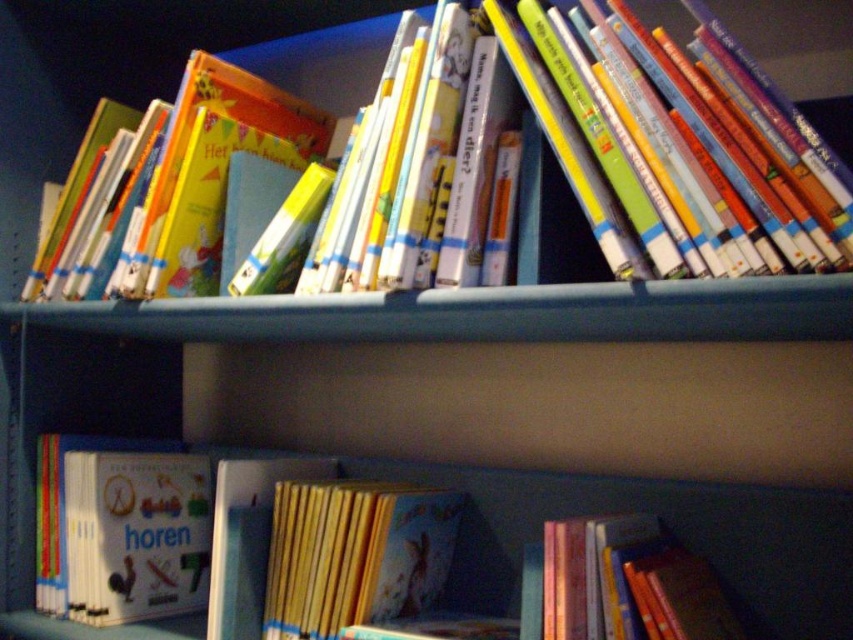
Is hardcover books at upper center closer to the viewer compared to shiny pink book at lower right?

That is True.

Where is `hardcover books at upper center`? This screenshot has height=640, width=853. hardcover books at upper center is located at coordinates (675, 145).

At what (x,y) coordinates should I click in order to perform the action: click on hardcover books at upper center. Please return your answer as a coordinate pair (x, y). Looking at the image, I should click on (675, 145).

Locate an element on the screen. Image resolution: width=853 pixels, height=640 pixels. hardcover books at upper center is located at coordinates (675, 145).

Is hardcover books at upper center shorter than hardcover book at upper center?

Yes.

Is point (733, 212) more distant than point (834, 67)?

No, it is not.

Where is `hardcover books at upper center`? hardcover books at upper center is located at coordinates (675, 145).

Can you confirm if matte white book at left is positioned to the left of yellow paper at center?

Yes, matte white book at left is to the left of yellow paper at center.

Who is lower down, matte white book at left or yellow paper at center?

matte white book at left

Is point (135, 592) closer to viewer compared to point (444, 545)?

No, it is not.

Identify the location of matte white book at left. The height and width of the screenshot is (640, 853). (120, 529).